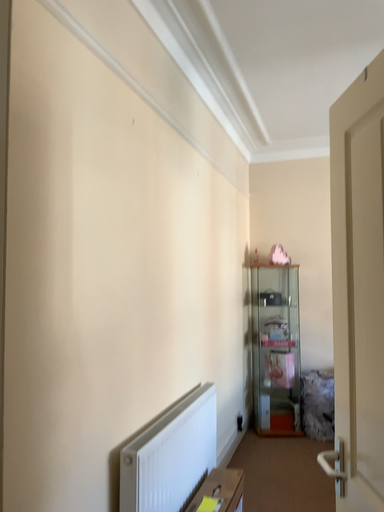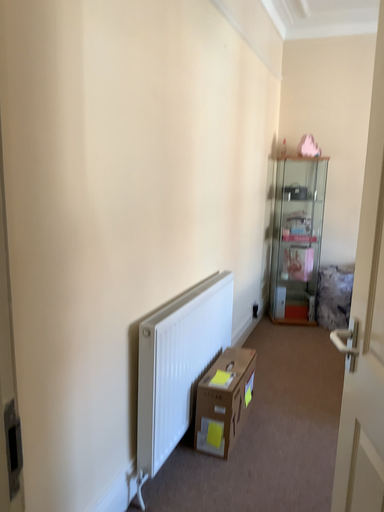
Question: How did the camera likely rotate when shooting the video?

Choices:
 (A) rotated upward
 (B) rotated downward

Answer: (B)